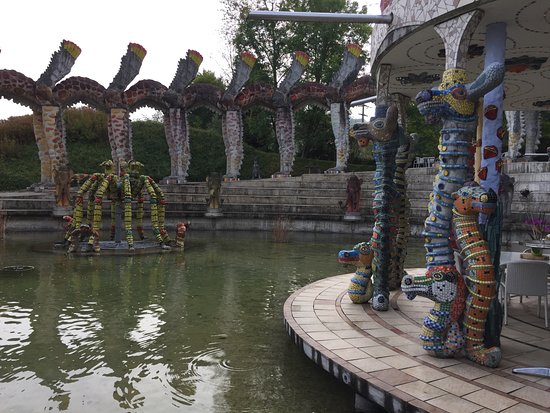
Identify the location of small sea horse like statues. (444, 304), (364, 261), (478, 258).